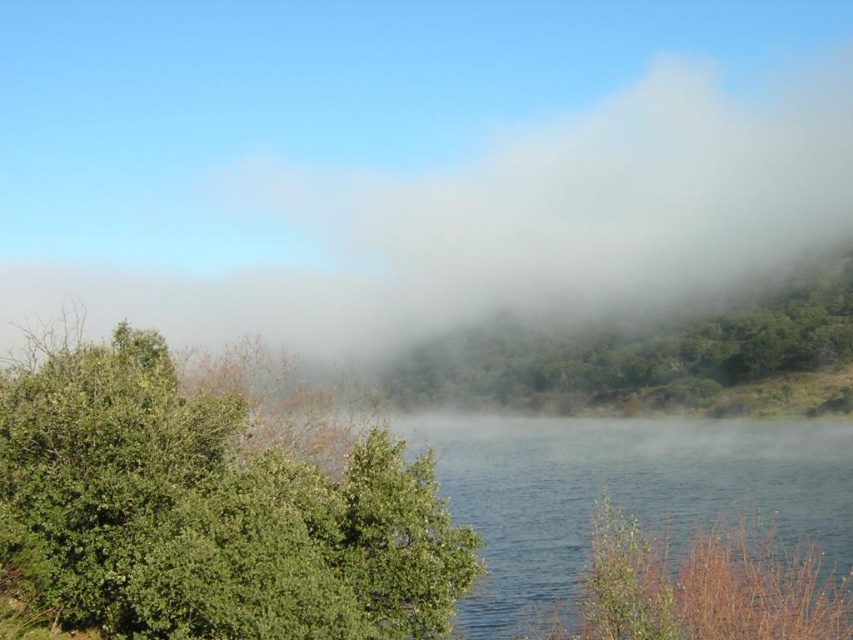
You are standing in the serene natural landscape with misty atmosphere. You see two points in the scene, point (221, 605) and point (821, 264). Which point is closer to you?

Point (221, 605) is in front of point (821, 264), so it is closer to you.

You are a drone operator tasked with capturing aerial footage of the serene landscape. Your drone has a maximum flight range of 200 meters. If you are positioned at the white misty fog at upper center, can you fly your drone to the clear water at center without exceeding its range?

The white misty fog at upper center and clear water at center are 209.37 meters apart from each other. Since the drone has a maximum flight range of 200 meters, it cannot reach the clear water at center without exceeding its range.